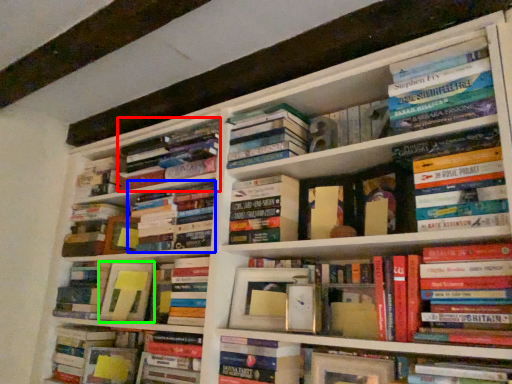
Question: Estimate the real-world distances between objects in this image. Which object is farther from book (highlighted by a red box), book (highlighted by a blue box) or paperback book (highlighted by a green box)?

Choices:
 (A) book
 (B) paperback book

Answer: (B)